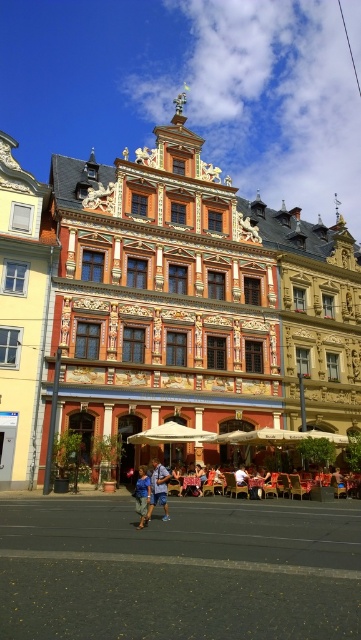
You are standing in the European town square looking at the ornate building. Where exactly is the blue denim shorts at center located in relation to the building?

The blue denim shorts at center is located at point 0.766 on the x axis and 0.438 on the y axis relative to the building.